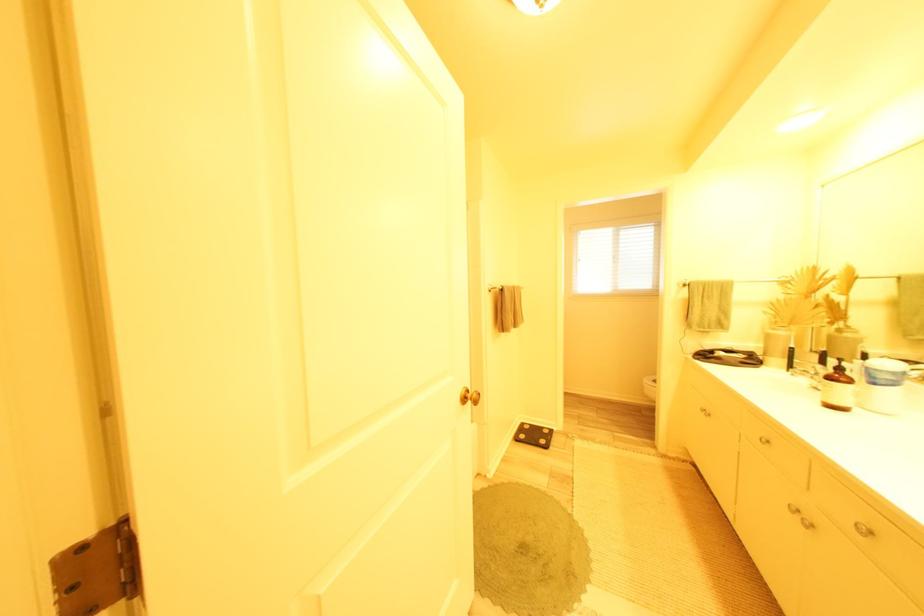
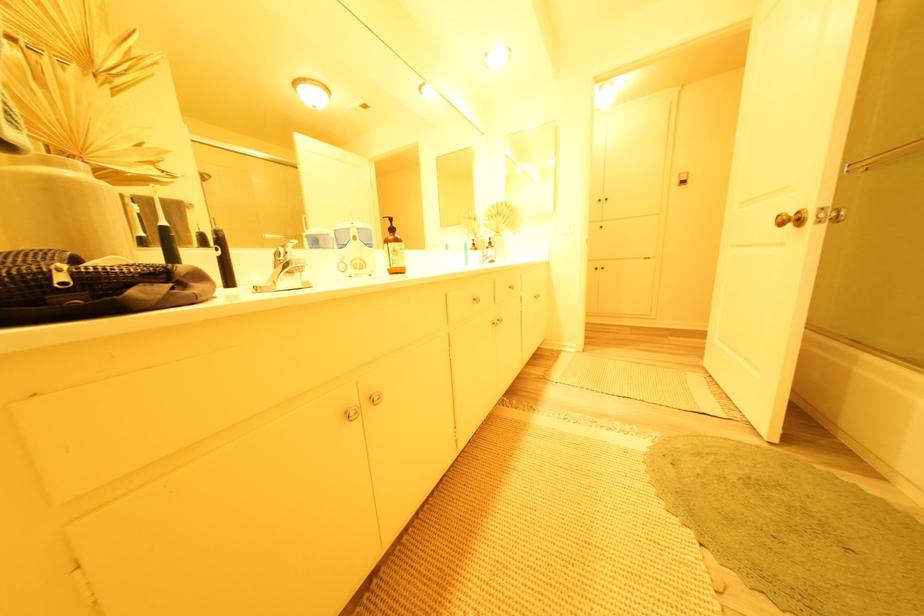
In the second image, find the point that corresponds to [480,405] in the first image.

(801, 227)